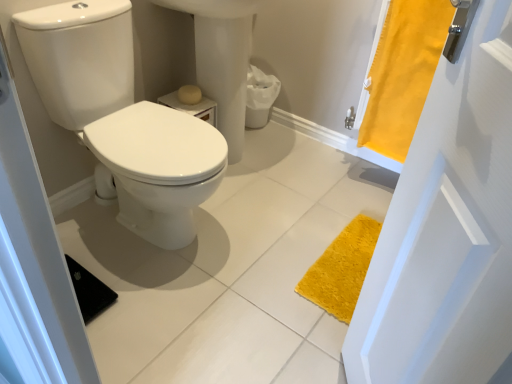
Question: Considering the relative sizes of white glossy toilet at left and yellow fabric curtain at right in the image provided, is white glossy toilet at left thinner than yellow fabric curtain at right?

Choices:
 (A) yes
 (B) no

Answer: (B)

Question: Does white glossy toilet at left have a greater width compared to yellow fabric curtain at right?

Choices:
 (A) no
 (B) yes

Answer: (B)

Question: Is white glossy toilet at left completely or partially outside of yellow fabric curtain at right?

Choices:
 (A) yes
 (B) no

Answer: (A)

Question: Is white glossy toilet at left taller than yellow fabric curtain at right?

Choices:
 (A) no
 (B) yes

Answer: (B)

Question: Does white glossy toilet at left appear on the right side of yellow fabric curtain at right?

Choices:
 (A) yes
 (B) no

Answer: (B)

Question: Is white glossy toilet at left wider or thinner than matte yellow toilet paper at center?

Choices:
 (A) wide
 (B) thin

Answer: (A)

Question: Looking at the image, does white glossy toilet at left seem bigger or smaller compared to matte yellow toilet paper at center?

Choices:
 (A) big
 (B) small

Answer: (A)

Question: Is white glossy toilet at left to the left or to the right of matte yellow toilet paper at center in the image?

Choices:
 (A) right
 (B) left

Answer: (B)

Question: From the image's perspective, is white glossy toilet at left positioned above or below matte yellow toilet paper at center?

Choices:
 (A) below
 (B) above

Answer: (A)

Question: From the image's perspective, is matte yellow toilet paper at center positioned above or below yellow fabric curtain at right?

Choices:
 (A) below
 (B) above

Answer: (A)

Question: Is point (187, 87) positioned closer to the camera than point (381, 89)?

Choices:
 (A) closer
 (B) farther

Answer: (B)

Question: Relative to yellow fabric curtain at right, is matte yellow toilet paper at center in front or behind?

Choices:
 (A) front
 (B) behind

Answer: (B)

Question: Is matte yellow toilet paper at center situated inside yellow fabric curtain at right or outside?

Choices:
 (A) inside
 (B) outside

Answer: (B)

Question: Based on their sizes in the image, would you say yellow fabric curtain at right is bigger or smaller than white glossy sink at center?

Choices:
 (A) big
 (B) small

Answer: (B)

Question: Looking at their shapes, would you say yellow fabric curtain at right is wider or thinner than white glossy sink at center?

Choices:
 (A) thin
 (B) wide

Answer: (A)